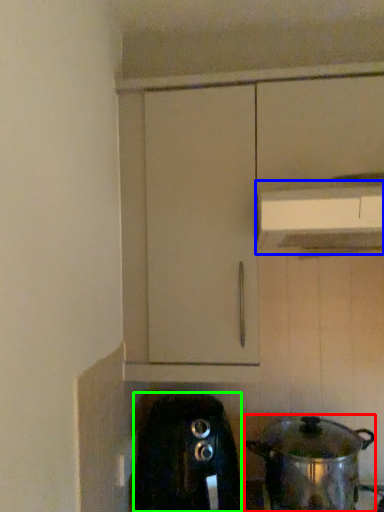
Question: Which object is the closest to the kitchen appliance (highlighted by a red box)? Choose among these: vent (highlighted by a blue box) or home appliance (highlighted by a green box).

Choices:
 (A) vent
 (B) home appliance

Answer: (B)